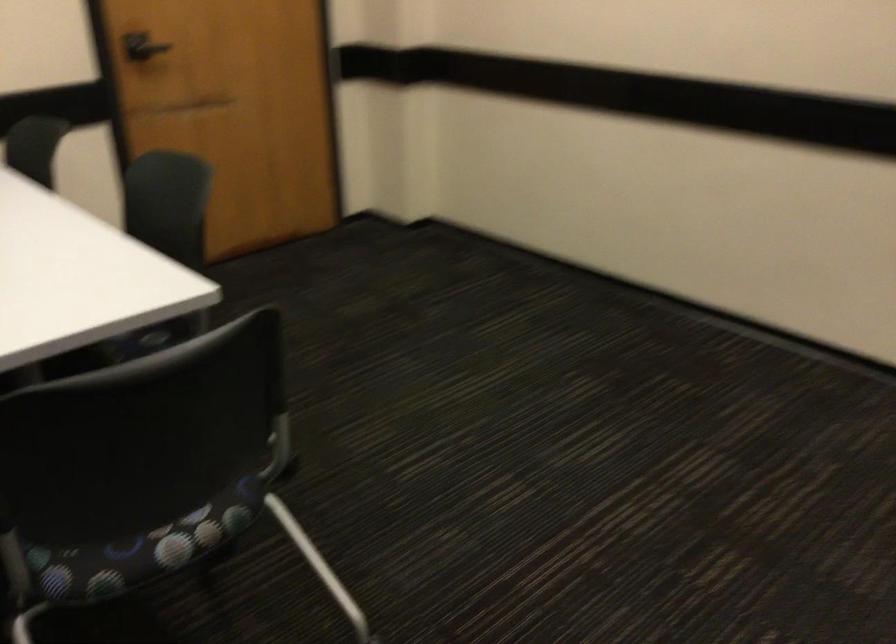
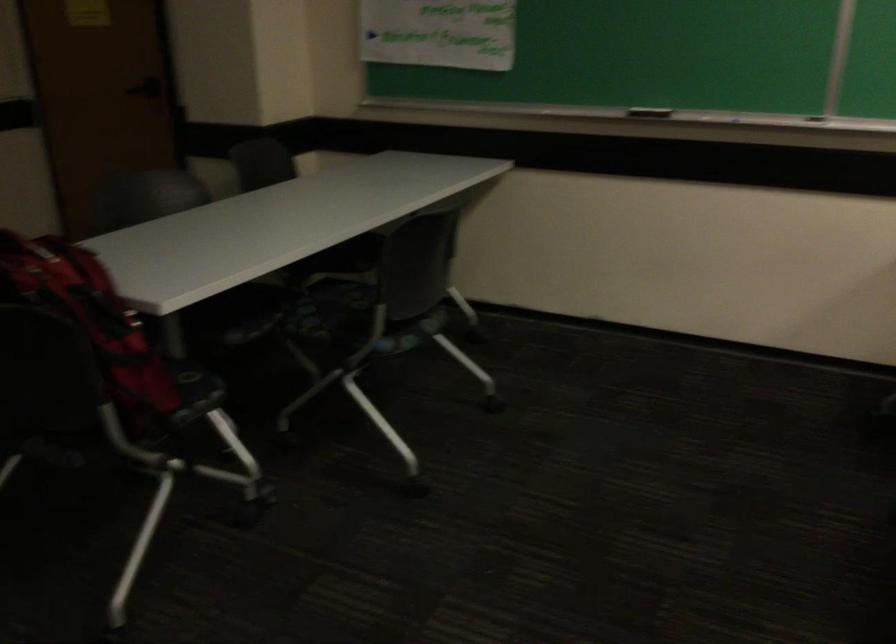
Question: The images are taken continuously from a first-person perspective. In which direction is your viewpoint rotating?

Choices:
 (A) Left
 (B) Right
 (C) Up
 (D) Down

Answer: (A)